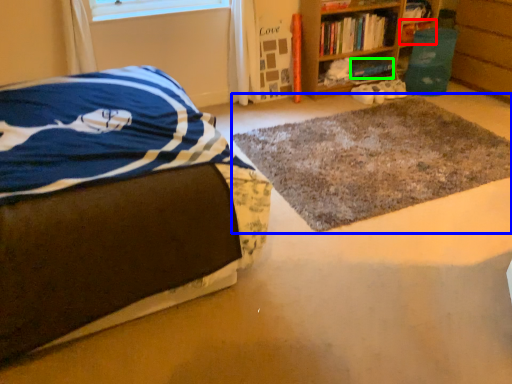
Question: Estimate the real-world distances between objects in this image. Which object is farther from book (highlighted by a red box), mat (highlighted by a blue box) or book (highlighted by a green box)?

Choices:
 (A) mat
 (B) book

Answer: (A)